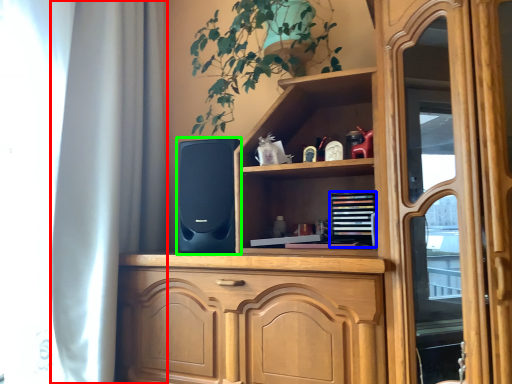
Question: Considering the real-world distances, which object is farthest from curtain (highlighted by a red box)? book (highlighted by a blue box) or speaker (highlighted by a green box)?

Choices:
 (A) book
 (B) speaker

Answer: (A)